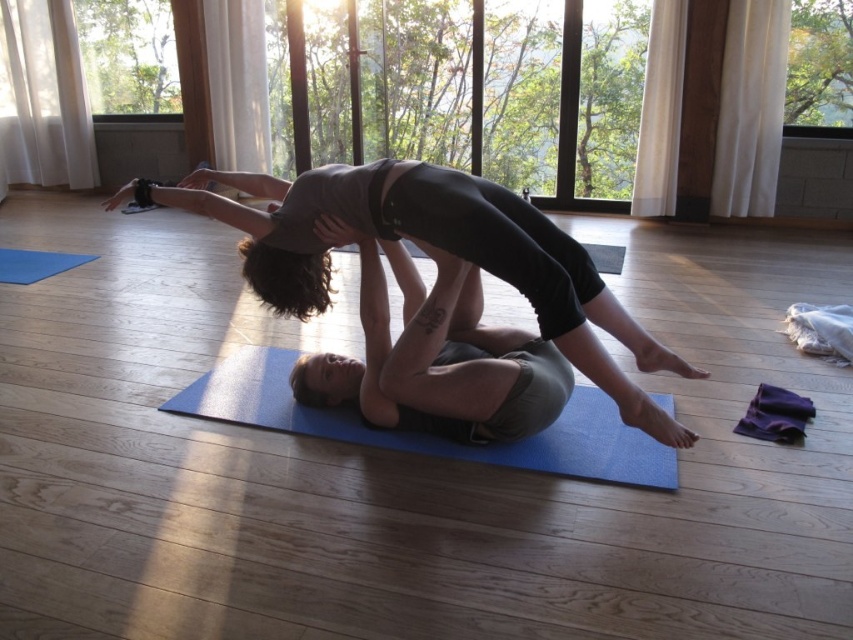
Looking at this image, who is shorter, black matte leggings at center or blue rubber yoga mat at center?

With less height is blue rubber yoga mat at center.

Is black matte leggings at center bigger than blue rubber yoga mat at center?

Indeed, black matte leggings at center has a larger size compared to blue rubber yoga mat at center.

What do you see at coordinates (434, 260) in the screenshot? Image resolution: width=853 pixels, height=640 pixels. I see `black matte leggings at center` at bounding box center [434, 260].

Identify the location of black matte leggings at center. Image resolution: width=853 pixels, height=640 pixels. point(434,260).

What do you see at coordinates (434, 260) in the screenshot? I see `black matte leggings at center` at bounding box center [434, 260].

Can you confirm if black matte leggings at center is positioned to the left of blue rubber mat at lower left?

In fact, black matte leggings at center is to the right of blue rubber mat at lower left.

Who is more forward, (374,172) or (33,256)?

Point (374,172) is in front.

The width and height of the screenshot is (853, 640). I want to click on black matte leggings at center, so click(434, 260).

Is blue rubber yoga mat at center further to camera compared to blue rubber mat at lower left?

No, it is in front of blue rubber mat at lower left.

Describe the element at coordinates (431, 435) in the screenshot. I see `blue rubber yoga mat at center` at that location.

Where is `blue rubber yoga mat at center`? blue rubber yoga mat at center is located at coordinates (431, 435).